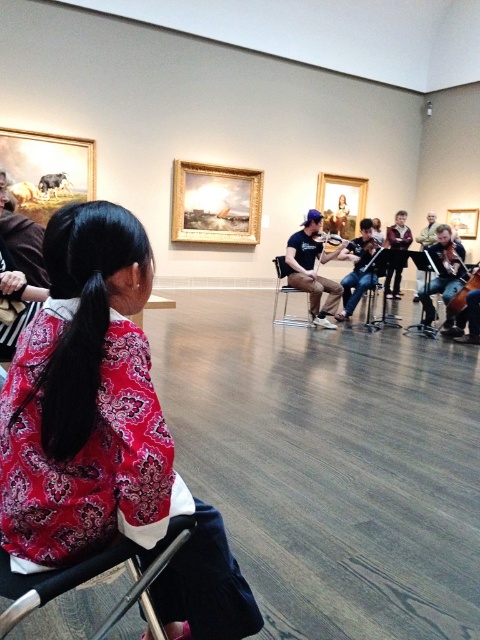
Question: Does matte black violin at center have a smaller size compared to dark brown polished wood cello at right?

Choices:
 (A) yes
 (B) no

Answer: (B)

Question: Which object appears farthest from the camera in this image?

Choices:
 (A) dark brown polished wood cello at right
 (B) red floral blouse at lower left

Answer: (A)

Question: Is red floral blouse at lower left positioned in front of black plastic chair at center?

Choices:
 (A) no
 (B) yes

Answer: (B)

Question: Which of the following is the farthest from the observer?

Choices:
 (A) dark brown polished wood cello at right
 (B) matte black violin at center

Answer: (B)

Question: Is metallic silver chair at center to the left of dark brown polished wood cello at right from the viewer's perspective?

Choices:
 (A) yes
 (B) no

Answer: (A)

Question: Which object is closer to the camera taking this photo?

Choices:
 (A) black plastic chair at center
 (B) dark blue t-shirt at center
 (C) shiny silver cello at center
 (D) dark brown leather jacket at center

Answer: (C)